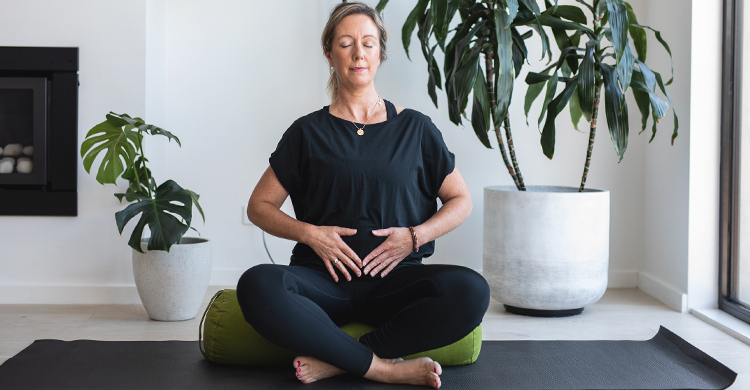
At what (x,y) coordinates should I click in order to perform the action: click on fireplace. Please return your answer as a coordinate pair (x, y). Looking at the image, I should click on (22, 156).